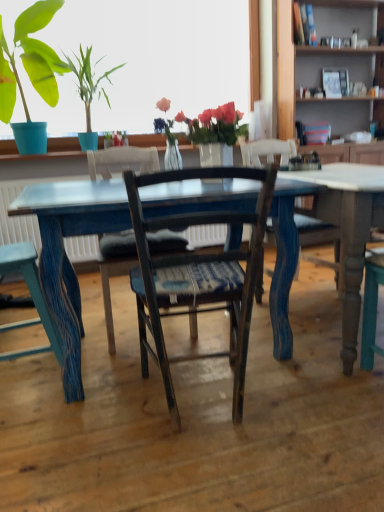
At what (x,y) coordinates should I click in order to perform the action: click on matte blue pot at upper left. Please return your answer as a coordinate pair (x, y). This screenshot has height=512, width=384. Looking at the image, I should click on coord(30,60).

I want to click on wooden chair with woven seat cushion at center, positioned as the 1th chair in right-to-left order, so click(197, 276).

The height and width of the screenshot is (512, 384). Describe the element at coordinates (114, 270) in the screenshot. I see `wooden chair at center, which ranks as the second chair in right-to-left order` at that location.

Image resolution: width=384 pixels, height=512 pixels. In order to click on blue painted wood table at center in this screenshot , I will do pyautogui.click(x=348, y=231).

At what (x,y) coordinates should I click in order to perform the action: click on matte blue pot at upper left. Please return your answer as a coordinate pair (x, y). This screenshot has height=512, width=384. Looking at the image, I should click on (30, 60).

Considering the relative positions of wooden chair at center, positioned as the 2th chair in left-to-right order, and blue painted wood table at center in the image provided, is wooden chair at center, positioned as the 2th chair in left-to-right order, to the right of blue painted wood table at center from the viewer's perspective?

Incorrect, wooden chair at center, positioned as the 2th chair in left-to-right order, is not on the right side of blue painted wood table at center.

How much distance is there between wooden chair at center, which ranks as the second chair in right-to-left order, and blue painted wood table at center?

wooden chair at center, which ranks as the second chair in right-to-left order, and blue painted wood table at center are 1.10 meters apart.

Does wooden chair at center, positioned as the 2th chair in left-to-right order, have a larger size compared to blue painted wood table at center?

No, wooden chair at center, positioned as the 2th chair in left-to-right order, is not bigger than blue painted wood table at center.

Does wooden chair at center, positioned as the 2th chair in left-to-right order, have a lesser width compared to blue painted wood table at center?

Correct, the width of wooden chair at center, positioned as the 2th chair in left-to-right order, is less than that of blue painted wood table at center.

Which object is closer to the camera taking this photo, wooden chair at center, which ranks as the second chair in right-to-left order, or wooden bookshelf at upper right?

wooden chair at center, which ranks as the second chair in right-to-left order, is more forward.

Is wooden chair at center, positioned as the 2th chair in left-to-right order, not inside wooden bookshelf at upper right?

That's correct, wooden chair at center, positioned as the 2th chair in left-to-right order, is outside of wooden bookshelf at upper right.

What are the coordinates of `bookshelf located above the wooden chair at center, positioned as the 2th chair in left-to-right order (from a real-world perspective)` in the screenshot? It's located at (320, 80).

Could you tell me if blue painted wood table at center is turned towards wooden bookshelf at upper right?

No, blue painted wood table at center is not facing towards wooden bookshelf at upper right.

Does point (330, 218) appear closer or farther from the camera than point (288, 59)?

Point (330, 218).

From a real-world perspective, is blue painted wood table at center positioned above or below wooden bookshelf at upper right?

Clearly, from a real-world perspective, blue painted wood table at center is below wooden bookshelf at upper right.

In the image, is wooden chair with woven seat cushion at center, positioned as the 1th chair in right-to-left order, on the left side or the right side of translucent glass vase at upper center?

Based on their positions, wooden chair with woven seat cushion at center, positioned as the 1th chair in right-to-left order, is located to the right of translucent glass vase at upper center.

Considering the sizes of objects wooden chair with woven seat cushion at center, arranged as the third chair when viewed from the left, and translucent glass vase at upper center in the image provided, who is thinner, wooden chair with woven seat cushion at center, arranged as the third chair when viewed from the left, or translucent glass vase at upper center?

translucent glass vase at upper center is thinner.

Consider the image. Is translucent glass vase at upper center completely or partially inside wooden chair with woven seat cushion at center, arranged as the third chair when viewed from the left?

No, translucent glass vase at upper center is not a part of wooden chair with woven seat cushion at center, arranged as the third chair when viewed from the left.

In the scene shown: Does wooden chair with woven seat cushion at center, arranged as the third chair when viewed from the left, have a smaller size compared to translucent glass vase at upper center?

Incorrect, wooden chair with woven seat cushion at center, arranged as the third chair when viewed from the left, is not smaller in size than translucent glass vase at upper center.

Is blue painted wood table at center oriented towards wooden chair at center, which ranks as the second chair in right-to-left order?

No, blue painted wood table at center is not oriented towards wooden chair at center, which ranks as the second chair in right-to-left order.

The image size is (384, 512). In order to click on the 2nd chair to the left of the blue painted wood table at center, starting your count from the anchor in this screenshot , I will do `click(114, 270)`.

Which object is wider, blue painted wood table at center or wooden chair at center, positioned as the 2th chair in left-to-right order?

Wider between the two is blue painted wood table at center.

Is wooden chair at center, positioned as the 2th chair in left-to-right order, a part of blue painted wood table at center?

No, wooden chair at center, positioned as the 2th chair in left-to-right order, is located outside of blue painted wood table at center.

Would you say wooden bookshelf at upper right is to the left or to the right of wooden chair with woven seat cushion at center, positioned as the 1th chair in right-to-left order, in the picture?

wooden bookshelf at upper right is positioned on wooden chair with woven seat cushion at center, positioned as the 1th chair in right-to-left order,'s right side.

Does point (371, 97) appear closer or farther from the camera than point (183, 313)?

Point (371, 97) is farther from the camera than point (183, 313).

From the image's perspective, starting from the wooden bookshelf at upper right, which chair is the 2nd one below? Please provide its 2D coordinates.

[(197, 276)]

Which object is wider, matte blue pot at upper left or distressed blue wood chair at lower left, which appears as the 1th chair when viewed from the left?

With larger width is matte blue pot at upper left.

In the scene shown: Does matte blue pot at upper left have a lesser height compared to distressed blue wood chair at lower left, the third chair from the right?

No.

Is matte blue pot at upper left oriented away from distressed blue wood chair at lower left, which appears as the 1th chair when viewed from the left?

matte blue pot at upper left does not have its back to distressed blue wood chair at lower left, which appears as the 1th chair when viewed from the left.

How distant is matte blue pot at upper left from distressed blue wood chair at lower left, which appears as the 1th chair when viewed from the left?

matte blue pot at upper left and distressed blue wood chair at lower left, which appears as the 1th chair when viewed from the left, are 1.78 meters apart.

You are a GUI agent. You are given a task and a screenshot of the screen. Output one action in this format:
    pyautogui.click(x=<x>, y=<y>)
    Task: Click on the table below the wooden chair at center, which ranks as the second chair in right-to-left order (from the image's perspective)
    Image resolution: width=384 pixels, height=512 pixels.
    Given the screenshot: What is the action you would take?
    pos(348,231)

Find the location of a particular element. The height and width of the screenshot is (512, 384). bookshelf that is above the wooden chair at center, positioned as the 2th chair in left-to-right order (from a real-world perspective) is located at coordinates (320, 80).

Which object lies further to the anchor point wooden bookshelf at upper right, translucent glass vase at upper center or wooden chair with woven seat cushion at center, positioned as the 1th chair in right-to-left order?

wooden chair with woven seat cushion at center, positioned as the 1th chair in right-to-left order, lies further to wooden bookshelf at upper right than the other object.

Estimate the real-world distances between objects in this image. Which object is further from matte blue pot at upper left, wooden chair at center, which ranks as the second chair in right-to-left order, or blue painted wood table at center?

blue painted wood table at center is further to matte blue pot at upper left.

Estimate the real-world distances between objects in this image. Which object is closer to translucent glass vase at upper center, blue painted wood table at center or wooden bookshelf at upper right?

The object closer to translucent glass vase at upper center is blue painted wood table at center.

From the image, which object appears to be farther from wooden bookshelf at upper right, translucent glass vase at upper center or distressed blue wood chair at lower left, which appears as the 1th chair when viewed from the left?

Among the two, distressed blue wood chair at lower left, which appears as the 1th chair when viewed from the left, is located further to wooden bookshelf at upper right.

Looking at the image, which one is located further to wooden bookshelf at upper right, wooden chair with woven seat cushion at center, positioned as the 1th chair in right-to-left order, or blue painted wood table at center?

wooden chair with woven seat cushion at center, positioned as the 1th chair in right-to-left order, is further to wooden bookshelf at upper right.

From the picture: Considering their positions, is distressed blue wood chair at lower left, which appears as the 1th chair when viewed from the left, positioned closer to wooden chair at center, positioned as the 2th chair in left-to-right order, than wooden chair with woven seat cushion at center, arranged as the third chair when viewed from the left?

distressed blue wood chair at lower left, which appears as the 1th chair when viewed from the left, lies closer to wooden chair at center, positioned as the 2th chair in left-to-right order, than the other object.

Estimate the real-world distances between objects in this image. Which object is closer to distressed blue wood chair at lower left, which appears as the 1th chair when viewed from the left, wooden chair at center, which ranks as the second chair in right-to-left order, or wooden chair with woven seat cushion at center, positioned as the 1th chair in right-to-left order?

Based on the image, wooden chair with woven seat cushion at center, positioned as the 1th chair in right-to-left order, appears to be nearer to distressed blue wood chair at lower left, which appears as the 1th chair when viewed from the left.

Estimate the real-world distances between objects in this image. Which object is closer to matte blue pot at upper left, wooden chair with woven seat cushion at center, positioned as the 1th chair in right-to-left order, or translucent glass vase at upper center?

Based on the image, translucent glass vase at upper center appears to be nearer to matte blue pot at upper left.

In order to click on plant between matte blue pot at upper left and wooden chair at center, positioned as the 2th chair in left-to-right order, vertically in this screenshot , I will do `click(169, 143)`.

The image size is (384, 512). Find the location of `chair situated between wooden chair at center, positioned as the 2th chair in left-to-right order, and blue painted wood table at center from left to right`. chair situated between wooden chair at center, positioned as the 2th chair in left-to-right order, and blue painted wood table at center from left to right is located at coordinates (197, 276).

Image resolution: width=384 pixels, height=512 pixels. Identify the location of plant positioned between wooden chair with woven seat cushion at center, arranged as the third chair when viewed from the left, and wooden bookshelf at upper right from near to far. (169, 143).

Locate an element on the screen. The width and height of the screenshot is (384, 512). plant situated between distressed blue wood chair at lower left, which appears as the 1th chair when viewed from the left, and blue painted wood table at center from left to right is located at coordinates (169, 143).